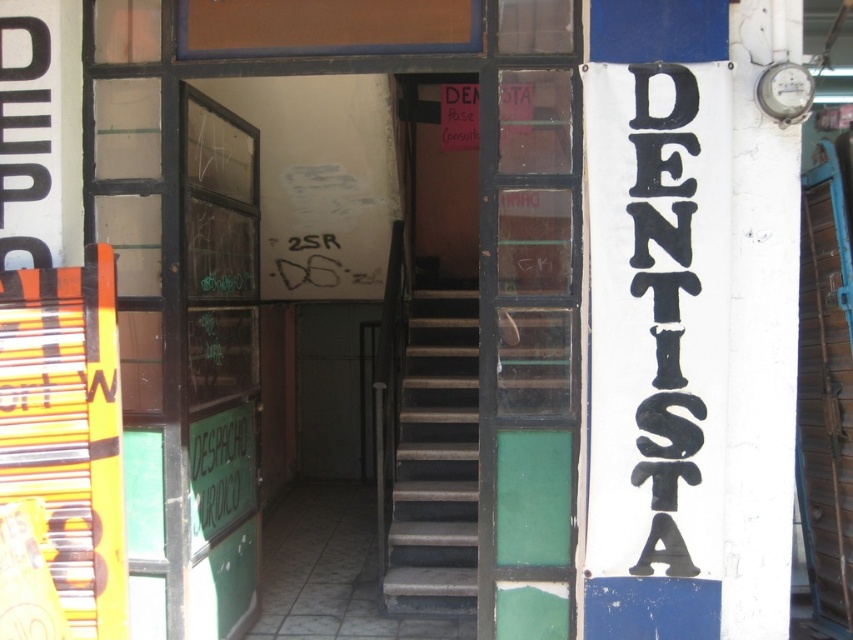
You are a person with a height of 6 feet. You are standing at the entrance of the dental clinic and need to go upstairs. The green glass door at center is locked. Can you climb the dark gray concrete stairs at center to reach the upper floor?

The green glass door at center and dark gray concrete stairs at center are 5.98 feet apart. Since you are 6 feet tall, you can comfortably climb the dark gray concrete stairs at center to reach the upper floor as the distance between them is sufficient for your height.